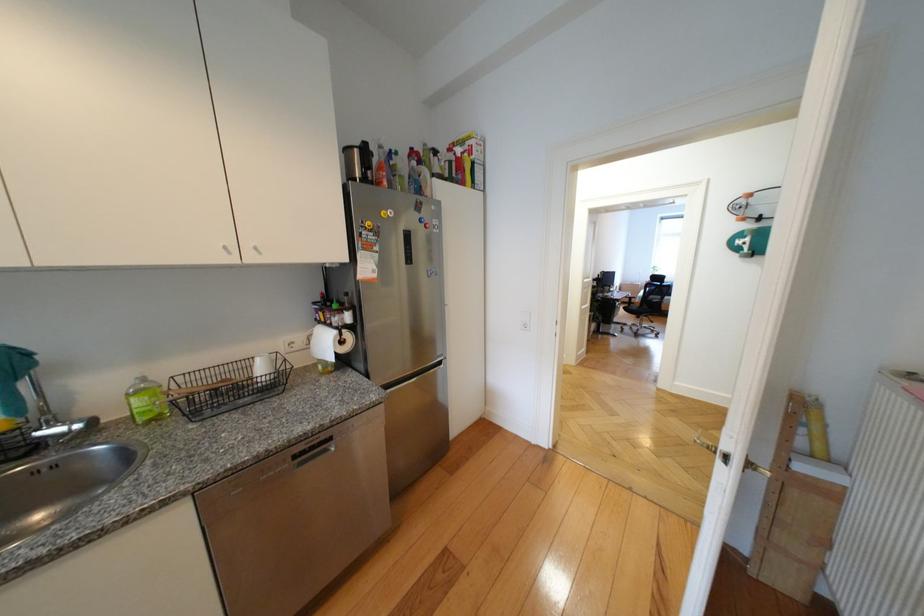
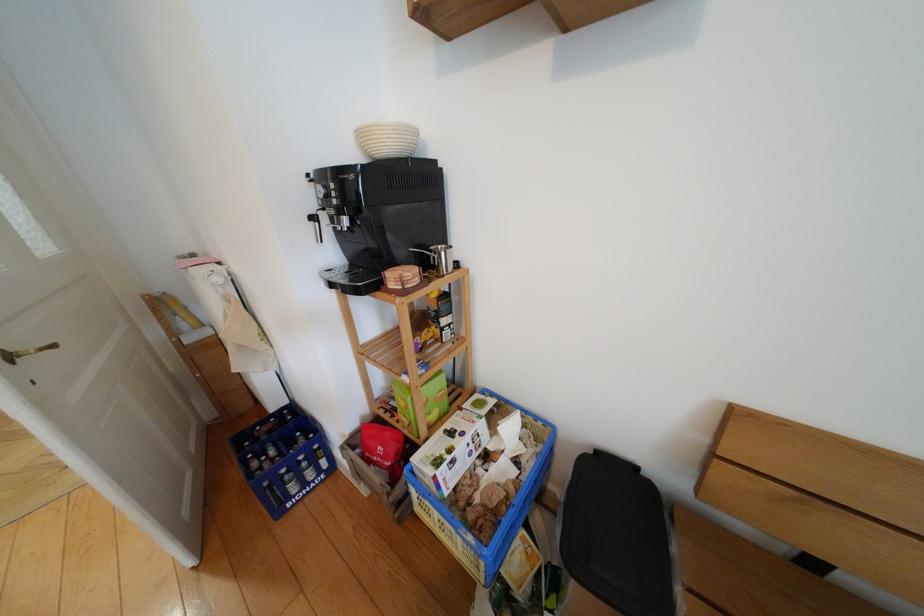
Based on the continuous images, in which direction is the camera rotating?

The camera's rotation is toward right-down.